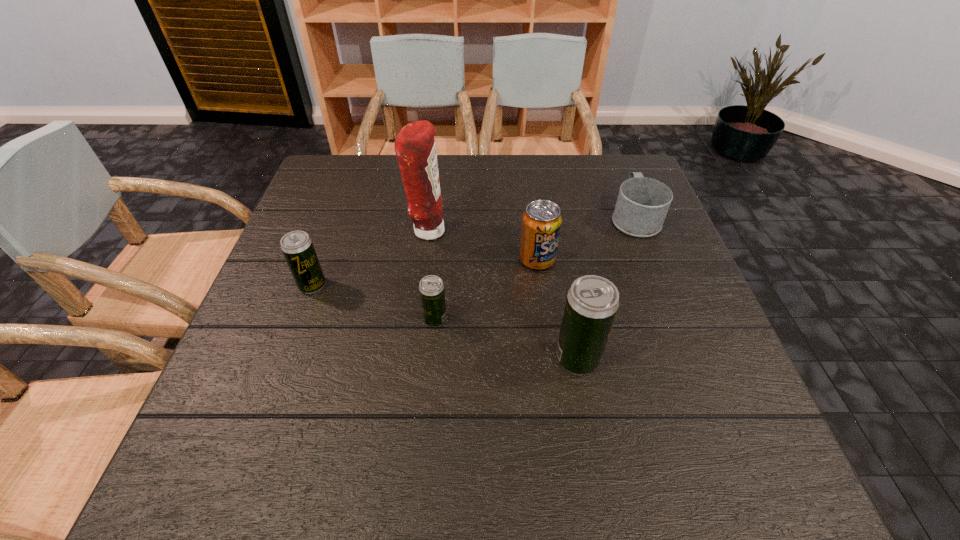
At what (x,y) coordinates should I click in order to perform the action: click on object that is at the far right corner. Please return your answer as a coordinate pair (x, y). The image size is (960, 540). Looking at the image, I should click on (642, 204).

Identify the location of free location at the far edge of the desktop. (511, 186).

Where is `vacant area at the near edge`? The image size is (960, 540). vacant area at the near edge is located at coordinates (643, 413).

Image resolution: width=960 pixels, height=540 pixels. Find the location of `vacant space at the left edge`. vacant space at the left edge is located at coordinates (305, 368).

Identify the location of vacant area at the right edge of the desktop. The image size is (960, 540). (671, 324).

In the image, there is a desktop. What are the coordinates of `vacant space at the far left corner` in the screenshot? It's located at (328, 161).

The image size is (960, 540). What are the coordinates of `blank space at the far right corner` in the screenshot? It's located at (596, 180).

In order to click on unoccupied area between the second farthest beer can and the nearest beer can in this screenshot , I will do `click(506, 339)`.

Locate an element on the screen. The width and height of the screenshot is (960, 540). blank region between the soda can and the second beer can from left to right is located at coordinates (486, 289).

Locate an element on the screen. vacant point located between the second nearest object and the second tallest object is located at coordinates (506, 339).